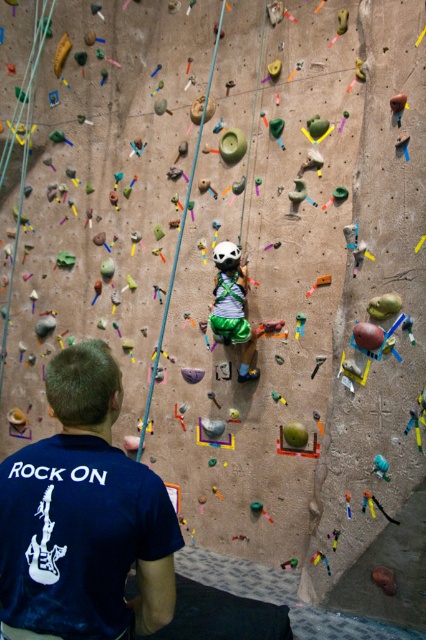
Question: Which object appears closest to the camera in this image?

Choices:
 (A) dark blue t-shirt at lower left
 (B) white matte helmet at center

Answer: (A)

Question: Can you confirm if dark blue t-shirt at lower left is thinner than white matte helmet at center?

Choices:
 (A) no
 (B) yes

Answer: (B)

Question: Which object appears farthest from the camera in this image?

Choices:
 (A) dark blue t-shirt at lower left
 (B) white matte helmet at center

Answer: (B)

Question: Is dark blue t-shirt at lower left below white matte helmet at center?

Choices:
 (A) yes
 (B) no

Answer: (A)

Question: Can you confirm if dark blue t-shirt at lower left is smaller than white matte helmet at center?

Choices:
 (A) yes
 (B) no

Answer: (A)